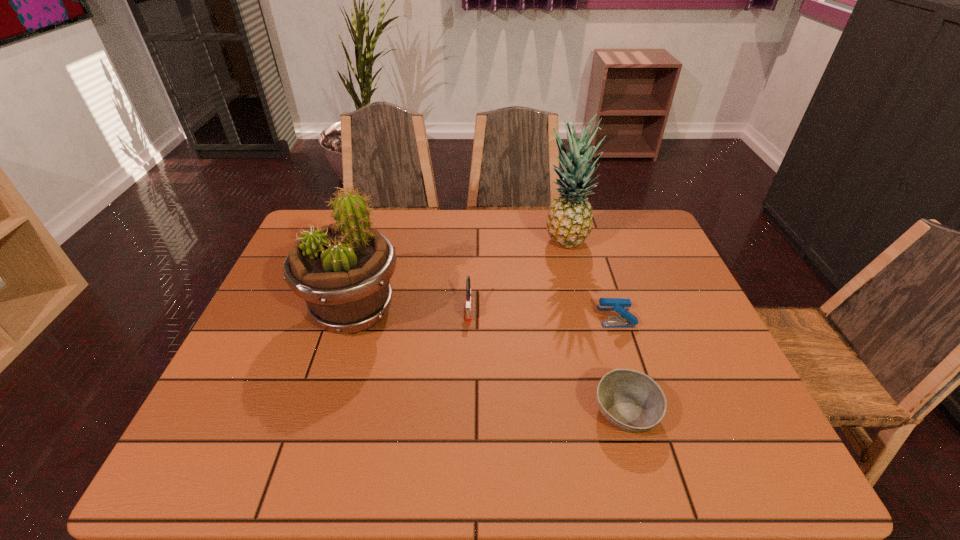
I want to click on vacant space located 0.220m on the handle side of the taller stapler, so click(467, 396).

Find the location of a particular element. This screenshot has height=540, width=960. vacant space located on the left of the shorter stapler is located at coordinates (487, 316).

This screenshot has width=960, height=540. I want to click on free space located 0.090m on the left of the nearest object, so click(550, 412).

Locate an element on the screen. object located at the far edge is located at coordinates (569, 222).

I want to click on object present at the near edge, so click(630, 400).

What are the coordinates of `object that is at the left edge` in the screenshot? It's located at (342, 271).

This screenshot has height=540, width=960. In order to click on blank space at the far edge of the desktop in this screenshot , I will do (442, 212).

Find the location of `vacant space at the near edge of the desktop`. vacant space at the near edge of the desktop is located at coordinates (458, 460).

Image resolution: width=960 pixels, height=540 pixels. Find the location of `free space at the left edge`. free space at the left edge is located at coordinates (277, 274).

Locate an element on the screen. vacant space at the right edge of the desktop is located at coordinates (726, 406).